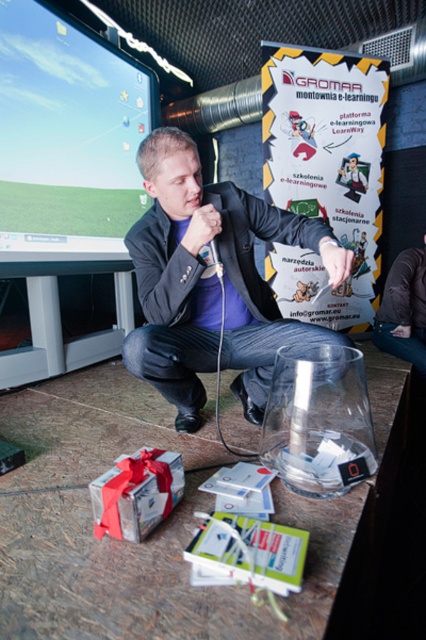
You are an assistant organizing a tech conference and need to place a new banner between the matte black jacket at center and the matte black monitor at upper left. Based on their positions, where should the banner be placed?

The matte black jacket at center is to the right of the matte black monitor at upper left, so the banner should be placed between them on the right side of the monitor and left side of the jacket.

You are a photographer standing in front of the scene. You need to capture a photo where the matte black jacket at center and the metallic silver game controller at center are both visible. Which object will appear larger in the photo?

The matte black jacket at center will appear larger in the photo because it is taller than the metallic silver game controller at center.

You are an interior designer planning to place a new shelf that must accommodate both the matte black monitor at upper left and the metallic silver game controller at center. Considering their sizes, which object requires a taller shelf space?

The matte black monitor at upper left requires a taller shelf space because it is much taller than the metallic silver game controller at center.